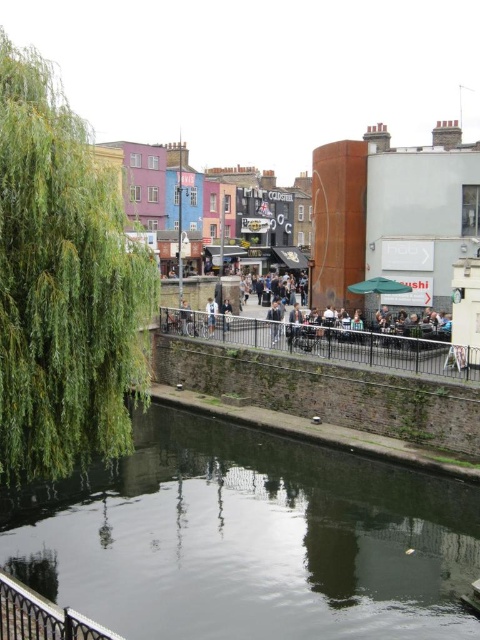
Question: Which object is the farthest from the dark reflective water at center?

Choices:
 (A) black metal rail at center
 (B) light brown wooden bench at center

Answer: (B)

Question: In this image, where is black metal rail at center located relative to light brown wooden bench at center?

Choices:
 (A) right
 (B) left

Answer: (A)

Question: Which object appears closest to the camera in this image?

Choices:
 (A) white fabric at center
 (B) light brown wooden bench at center

Answer: (A)

Question: Does green leafy tree at left have a larger size compared to light brown wooden bench at center?

Choices:
 (A) yes
 (B) no

Answer: (A)

Question: Based on their relative distances, which object is nearer to the light brown wooden bench at center?

Choices:
 (A) black metal rail at center
 (B) white fabric at center
 (C) dark reflective water at center
 (D) green leafy tree at left

Answer: (B)

Question: Is dark reflective water at center thinner than green leafy tree at left?

Choices:
 (A) yes
 (B) no

Answer: (B)